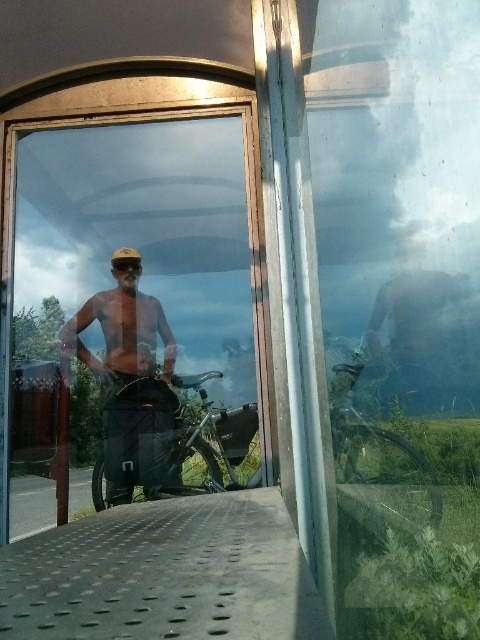
You are standing at the bus stop and want to reach a point marked at coordinates point (78, 314). Given that the distance between you and this point is 9.80 feet, can you comfortably walk to it without any obstacles?

The distance between you and the point (78, 314) is 9.80 feet. Assuming no obstacles, you can comfortably walk to it as 9.80 feet is a manageable distance for a person to cover.

Based on the photo, you are a cyclist preparing to ride through a forest trail. You have a shiny metallic helmet at center and matte black goggles at center. Which item should you put on first to ensure the goggles remain clean from sweat?

The shiny metallic helmet at center should be put on first because it is in front of the matte black goggles at center, so placing the helmet first would prevent sweat from dripping onto the goggles.